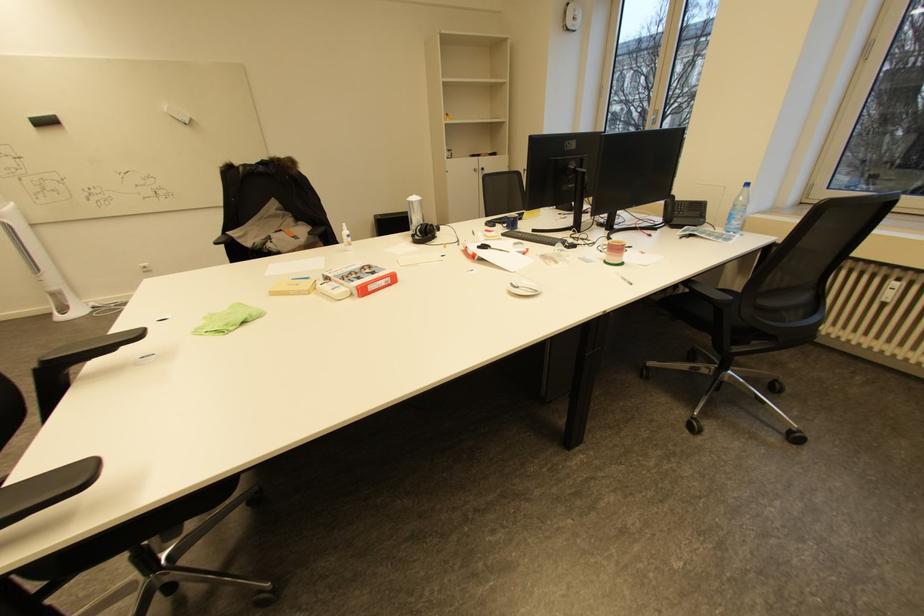
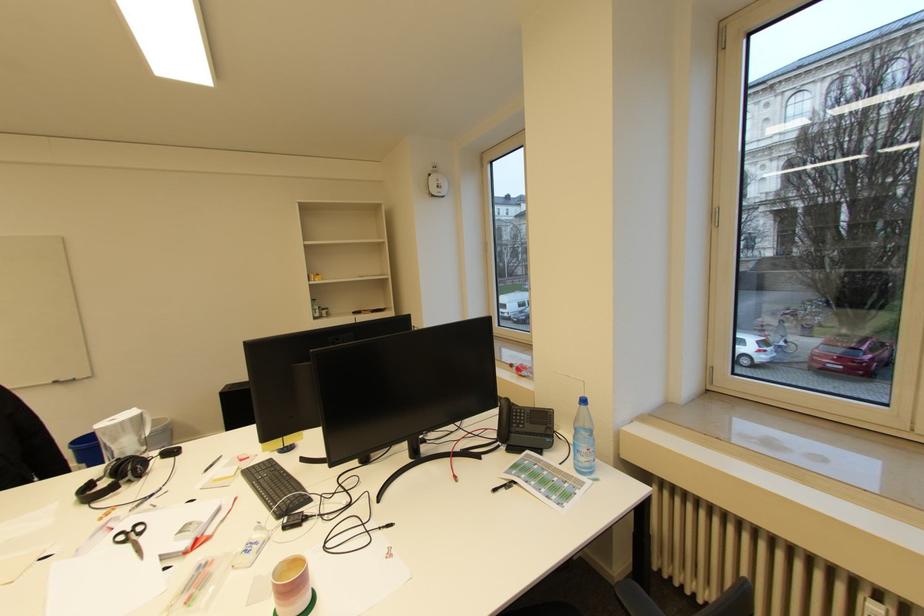
Find the pixel in the second image that matches pixel 685 209 in the first image.

(523, 419)